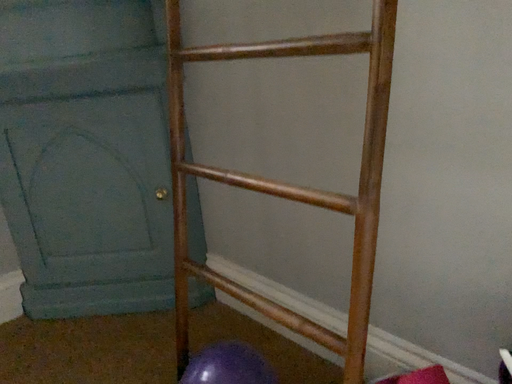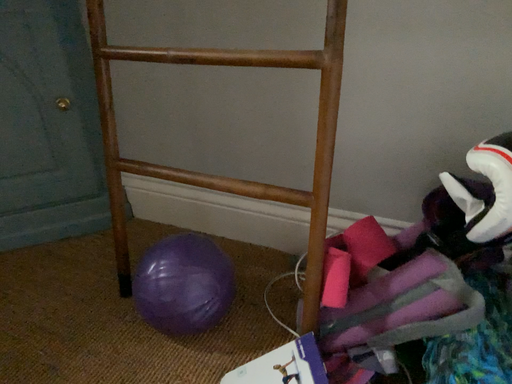
Question: Which way did the camera rotate in the video?

Choices:
 (A) rotated right
 (B) rotated left

Answer: (A)